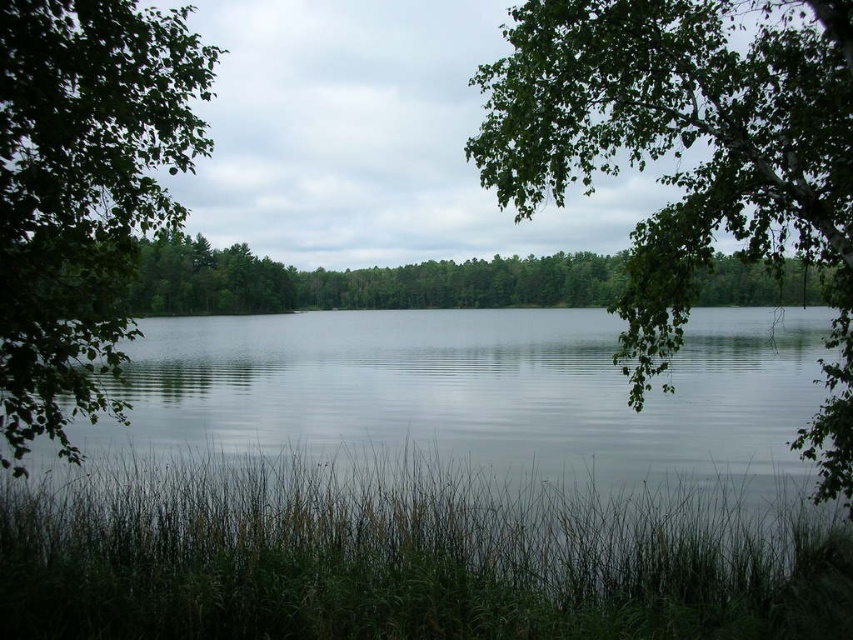
Is green leafy tree at upper right in front of green leafy tree at left?

That is False.

The image size is (853, 640). What do you see at coordinates (683, 150) in the screenshot?
I see `green leafy tree at upper right` at bounding box center [683, 150].

I want to click on green leafy tree at upper right, so click(683, 150).

Is point (466, 412) farther from viewer compared to point (160, 138)?

That is True.

At what (x,y) coordinates should I click in order to perform the action: click on clear water at center. Please return your answer as a coordinate pair (x, y). The image size is (853, 640). Looking at the image, I should click on (476, 387).

Who is more distant from viewer, [262,445] or [28,129]?

Positioned behind is point [262,445].

Identify the location of clear water at center. The image size is (853, 640). (476, 387).

Can you confirm if clear water at center is positioned to the right of green leafy tree at upper right?

In fact, clear water at center is to the left of green leafy tree at upper right.

Measure the distance between clear water at center and green leafy tree at upper right.

clear water at center is 5.81 meters from green leafy tree at upper right.

Which is in front, point (546, 456) or point (804, 205)?

Point (804, 205) is in front.

Find the location of a particular element. This screenshot has width=853, height=640. clear water at center is located at coordinates (476, 387).